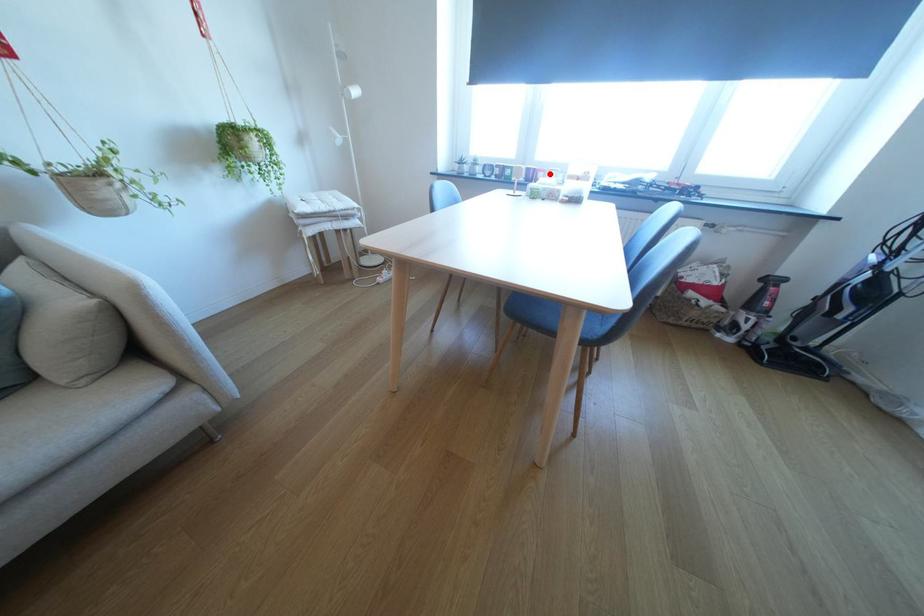
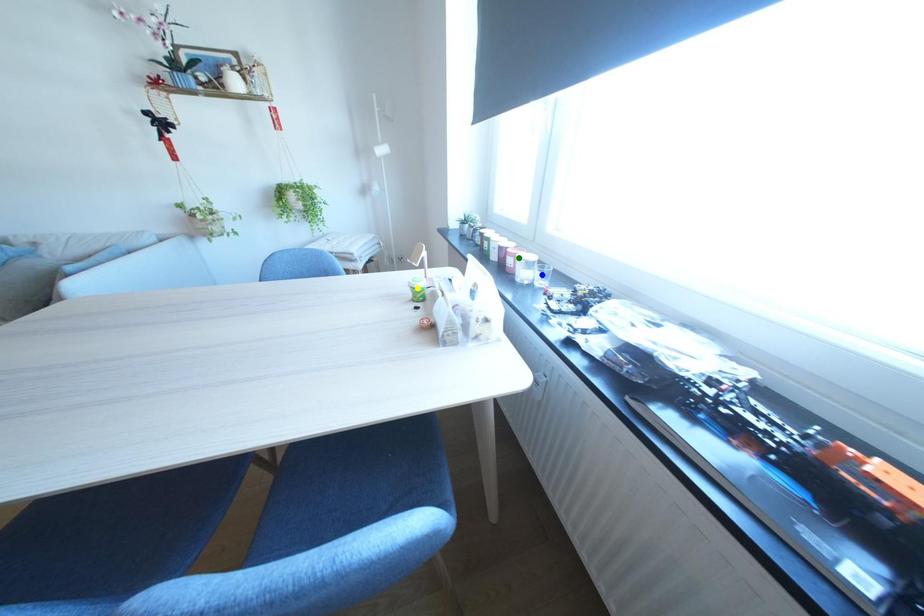
Question: I am providing you with two images of the same scene from different viewpoints. A red point is marked on the first image. You are given multiple points on the second image. In image 2, which mark is for the same physical point as the one in image 1?

Choices:
 (A) green point
 (B) yellow point
 (C) blue point

Answer: (A)